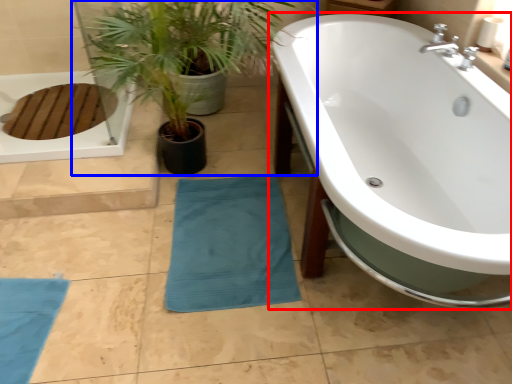
Question: Which point is closer to the camera, bathtub (highlighted by a red box) or houseplant (highlighted by a blue box)?

Choices:
 (A) bathtub
 (B) houseplant

Answer: (A)